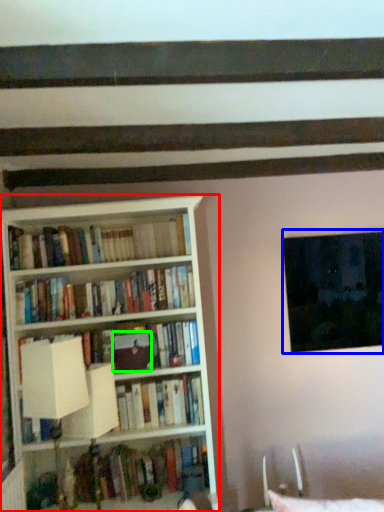
Question: Which is farther away from bookcase (highlighted by a red box)? window (highlighted by a blue box) or paperback book (highlighted by a green box)?

Choices:
 (A) window
 (B) paperback book

Answer: (A)